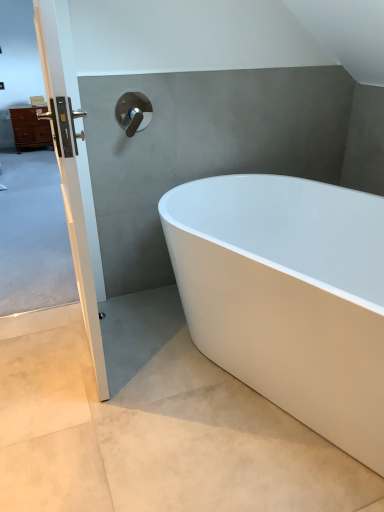
The image size is (384, 512). Find the location of `free space behind white glossy door handle at left`. free space behind white glossy door handle at left is located at coordinates (135, 306).